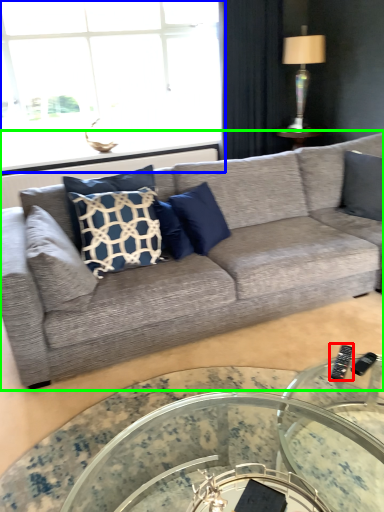
Question: Based on their relative distances, which object is farther from remote (highlighted by a red box)? Choose from window (highlighted by a blue box) and studio couch (highlighted by a green box).

Choices:
 (A) window
 (B) studio couch

Answer: (A)